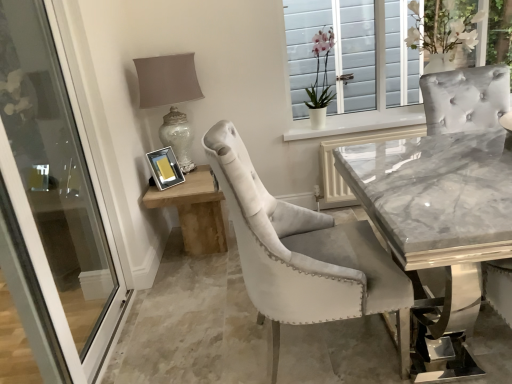
Find the location of `vacant space that is in between matte silver table lamp at upper left and metallic silver picture frame at upper center`. vacant space that is in between matte silver table lamp at upper left and metallic silver picture frame at upper center is located at coordinates (186, 182).